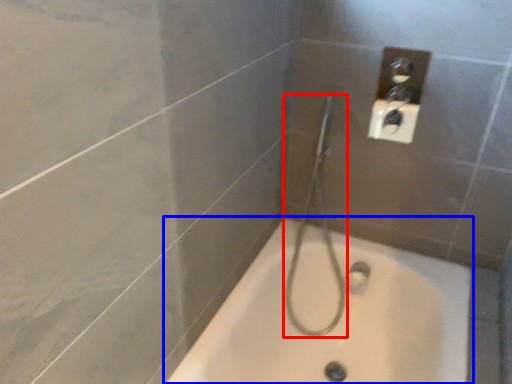
Question: Among these objects, which one is nearest to the camera, shower (highlighted by a red box) or bathtub (highlighted by a blue box)?

Choices:
 (A) shower
 (B) bathtub

Answer: (B)